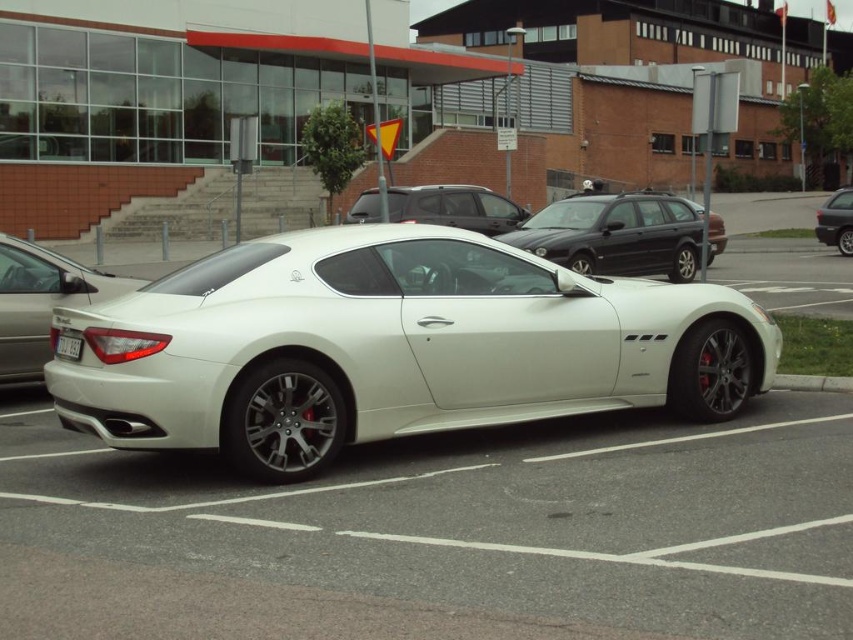
You are a parking attendant who needs to verify the license plate of the white metallic sports car at center. Since the car is above the white plastic license plate at center, where should you look to find the license plate?

The white plastic license plate at center is located below the white metallic sports car at center, so you should look below the car to find the license plate.

You are standing at the entrance of the building and want to park your car in the parking lot. The parking spot you want is located at point coordinates of 0.4, 0.7. Is the glossy black station wagon at center blocking your path to that parking spot?

The glossy black station wagon at center is located at point coordinates of (616, 234), which is very close to your desired parking spot at (596, 256). Depending on the exact positioning, it might be blocking your path.